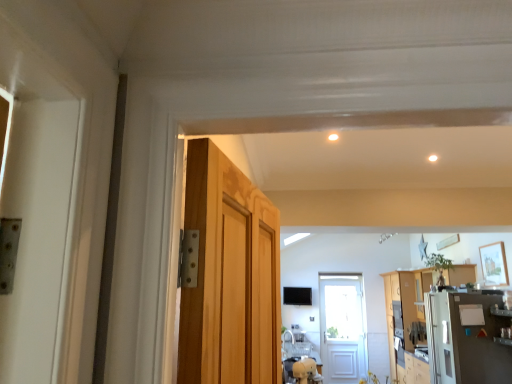
The height and width of the screenshot is (384, 512). I want to click on vacant space behind white glossy light at upper center, so click(x=329, y=146).